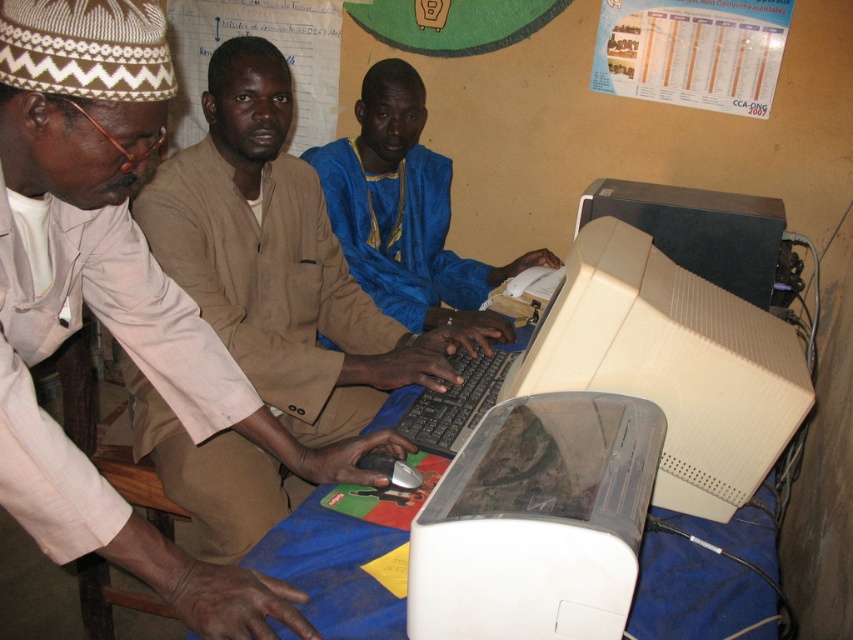
You are standing in the room and want to reach the point at coordinates [41,508]. Can you estimate how far you need to walk to get there?

The point at coordinates [41,508] is 35.39 inches away from the viewer, so you need to walk approximately 35.39 inches to reach it.